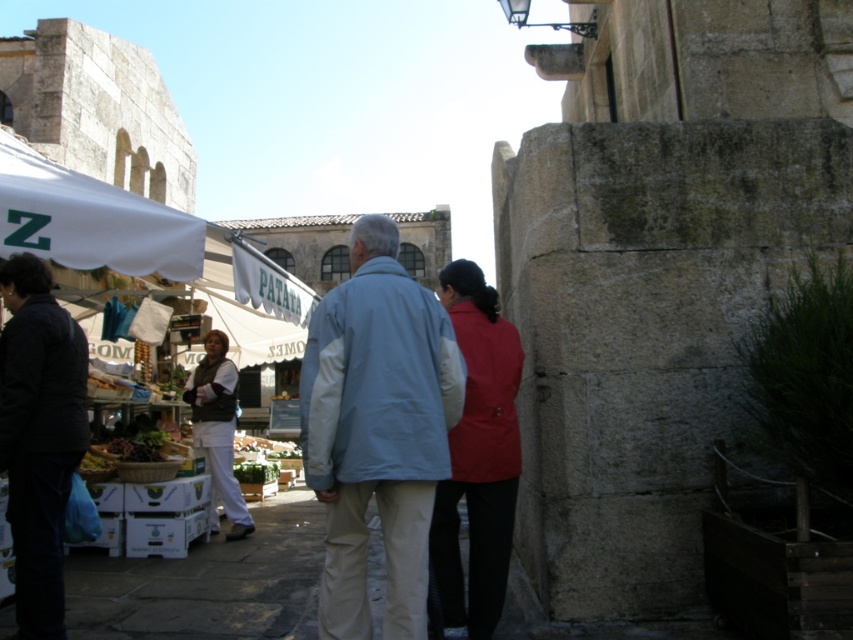
Based on the photo, you are standing at the back of the market and want to hand a brochure to the person wearing the white cotton pants at lower left. Which direction should you walk to approach them first, considering their position relative to the matte red jacket at center?

The matte red jacket at center is closer to the viewer than the white cotton pants at lower left. To reach the white cotton pants at lower left first, you should walk towards the matte red jacket at center since it is in front of them, indicating they are behind it.

You are standing at the entrance of the market and want to find the light blue fabric jacket at center. Which direction should you look to locate it?

The light blue fabric jacket at center is located at point (376, 429), which is towards the center of the image. Look straight ahead to find it.